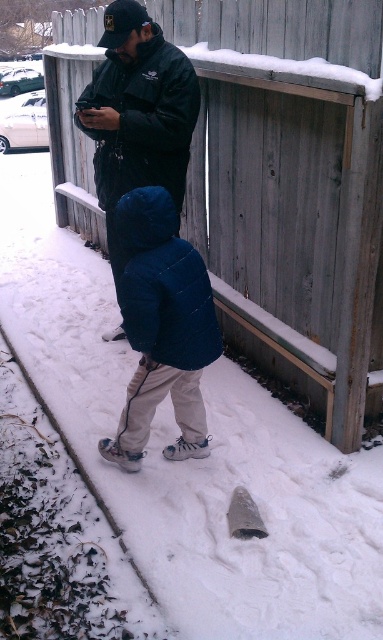
You are standing in the snowy winter scene and want to take a photo of the gray wood fence at upper center and the matte black jacket at center. Which object should you frame first in your camera to ensure both are in the shot?

The gray wood fence at upper center is positioned on the right side of matte black jacket at center. To include both in the shot, frame the matte black jacket at center first as it is closer to the left side, then adjust the camera to include the gray wood fence at upper center on the right.

You are standing at point (368,112) and want to walk to the wooden structure. Is the adult or the child closer to the wooden structure?

The child is closer to the wooden structure because they are walking towards it, while the adult is at point (368,112) which is farther away.

You are standing at the camera position and want to throw a snowball to the person wearing the dark blue puffy jacket at center. If your throwing range is 8 feet, will you be able to reach them?

The dark blue puffy jacket at center and the camera are 8.36 feet apart. Since your throwing range is 8 feet, you cannot reach them as the distance exceeds your range.